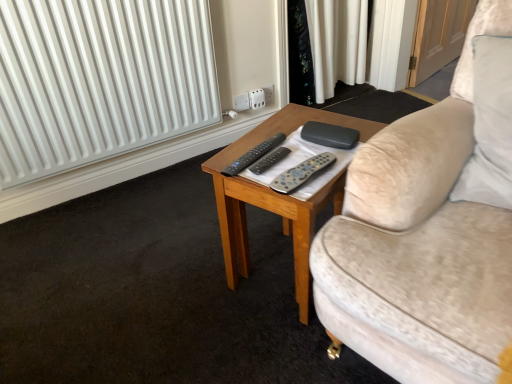
What are the coordinates of `black plastic remote control at center, arranged as the 2th remote control when viewed from the left` in the screenshot? It's located at coord(269,160).

Consider the image. How much space does black plastic remote control at center, which is counted as the 2th remote control, starting from the right, occupy vertically?

It is 1.18 inches.

Measure the distance between wooden coffee table at center and camera.

The distance of wooden coffee table at center from camera is 97.28 centimeters.

Find the location of a particular element. The width and height of the screenshot is (512, 384). white plastic socket at upper center is located at coordinates (257, 99).

The width and height of the screenshot is (512, 384). What do you see at coordinates (302, 173) in the screenshot?
I see `gray matte remote control at center, placed as the 3th remote control when sorted from left to right` at bounding box center [302, 173].

Identify the location of black plastic remote control at center, arranged as the 2th remote control when viewed from the left. (269, 160).

From a real-world perspective, is gray matte remote control at center, the 1th remote control viewed from the right, located higher than black matte case at center?

Incorrect, from a real-world perspective, gray matte remote control at center, the 1th remote control viewed from the right, is lower than black matte case at center.

The image size is (512, 384). Find the location of `pad above the gray matte remote control at center, placed as the 3th remote control when sorted from left to right (from a real-world perspective)`. pad above the gray matte remote control at center, placed as the 3th remote control when sorted from left to right (from a real-world perspective) is located at coordinates (330, 135).

Who is taller, gray matte remote control at center, placed as the 3th remote control when sorted from left to right, or black matte case at center?

With more height is black matte case at center.

Does black plastic remote control at center, which is counted as the 2th remote control, starting from the right, turn towards wooden coffee table at center?

No, black plastic remote control at center, which is counted as the 2th remote control, starting from the right, is not oriented towards wooden coffee table at center.

Are black plastic remote control at center, arranged as the 2th remote control when viewed from the left, and wooden coffee table at center far apart?

No, black plastic remote control at center, arranged as the 2th remote control when viewed from the left, is not far from wooden coffee table at center.

Considering the relative sizes of black plastic remote control at center, which is counted as the 2th remote control, starting from the right, and wooden coffee table at center in the image provided, is black plastic remote control at center, which is counted as the 2th remote control, starting from the right, wider than wooden coffee table at center?

No.

How much distance is there between black plastic remote control at center, which is counted as the 2th remote control, starting from the right, and wooden coffee table at center?

black plastic remote control at center, which is counted as the 2th remote control, starting from the right, and wooden coffee table at center are 8.84 inches apart from each other.

Is gray matte remote control at center, the 1th remote control viewed from the right, shorter than black plastic remote control at center, which is counted as the 2th remote control, starting from the right?

No.

From the image's perspective, which is below, gray matte remote control at center, the 1th remote control viewed from the right, or black plastic remote control at center, arranged as the 2th remote control when viewed from the left?

gray matte remote control at center, the 1th remote control viewed from the right, appears lower in the image.

Locate an element on the screen. The height and width of the screenshot is (384, 512). the 1st remote control above the gray matte remote control at center, placed as the 3th remote control when sorted from left to right (from the image's perspective) is located at coordinates (269, 160).

From a real-world perspective, is gray matte remote control at center, placed as the 3th remote control when sorted from left to right, positioned under black plastic remote control at center, arranged as the 2th remote control when viewed from the left, based on gravity?

No, from a real-world perspective, gray matte remote control at center, placed as the 3th remote control when sorted from left to right, is not under black plastic remote control at center, arranged as the 2th remote control when viewed from the left.

Which object is thinner, white plastic socket at upper center or black matte remote control at center, which appears as the first remote control when viewed from the left?

Thinner between the two is white plastic socket at upper center.

Considering the positions of objects white plastic socket at upper center and black matte remote control at center, which appears as the first remote control when viewed from the left, in the image provided, who is more to the left, white plastic socket at upper center or black matte remote control at center, which appears as the first remote control when viewed from the left,?

black matte remote control at center, which appears as the first remote control when viewed from the left.

From the picture: From the image's perspective, which is below, white plastic socket at upper center or black matte remote control at center, which appears as the first remote control when viewed from the left?

black matte remote control at center, which appears as the first remote control when viewed from the left, from the image's perspective.

Is white plastic socket at upper center placed right next to black matte remote control at center, which appears as the first remote control when viewed from the left?

No, white plastic socket at upper center is not beside black matte remote control at center, which appears as the first remote control when viewed from the left.

Is black matte case at center positioned far away from black plastic remote control at center, arranged as the 2th remote control when viewed from the left?

No.

Is black plastic remote control at center, which is counted as the 2th remote control, starting from the right, surrounded by black matte case at center?

That's incorrect, black plastic remote control at center, which is counted as the 2th remote control, starting from the right, is not inside black matte case at center.

Is black matte case at center facing towards black plastic remote control at center, arranged as the 2th remote control when viewed from the left?

Yes, black matte case at center is turned towards black plastic remote control at center, arranged as the 2th remote control when viewed from the left.

Is white plastic socket at upper center turned away from wooden coffee table at center?

No, white plastic socket at upper center is not facing away from wooden coffee table at center.

Is white plastic socket at upper center located outside wooden coffee table at center?

Yes.

Consider the image. From the image's perspective, is white plastic socket at upper center over wooden coffee table at center?

Yes, from the image's perspective, white plastic socket at upper center is above wooden coffee table at center.

This screenshot has height=384, width=512. I want to click on coffee table below the black matte case at center (from a real-world perspective), so click(276, 197).

Between wooden coffee table at center and black matte case at center, which one has less height?

Standing shorter between the two is black matte case at center.

Considering the sizes of objects wooden coffee table at center and black matte case at center in the image provided, who is thinner, wooden coffee table at center or black matte case at center?

Thinner between the two is black matte case at center.

I want to click on pad located behind the gray matte remote control at center, the 1th remote control viewed from the right, so click(330, 135).

The height and width of the screenshot is (384, 512). I want to click on the 2nd remote control positioned above the wooden coffee table at center (from the image's perspective), so click(x=269, y=160).

Looking at the image, which one is located closer to black plastic remote control at center, arranged as the 2th remote control when viewed from the left, black matte remote control at center, which appears as the first remote control when viewed from the left, or black matte case at center?

black matte remote control at center, which appears as the first remote control when viewed from the left, is closer to black plastic remote control at center, arranged as the 2th remote control when viewed from the left.

From the image, which object appears to be nearer to black matte remote control at center, which appears as the first remote control when viewed from the left, black matte case at center or black plastic remote control at center, which is counted as the 2th remote control, starting from the right?

The object closer to black matte remote control at center, which appears as the first remote control when viewed from the left, is black plastic remote control at center, which is counted as the 2th remote control, starting from the right.

Estimate the real-world distances between objects in this image. Which object is closer to black plastic remote control at center, which is counted as the 2th remote control, starting from the right, gray matte remote control at center, placed as the 3th remote control when sorted from left to right, or black matte remote control at center, the third remote control positioned from the right?

Among the two, black matte remote control at center, the third remote control positioned from the right, is located nearer to black plastic remote control at center, which is counted as the 2th remote control, starting from the right.

Considering their positions, is black matte remote control at center, the third remote control positioned from the right, positioned further to wooden coffee table at center than gray matte remote control at center, placed as the 3th remote control when sorted from left to right?

gray matte remote control at center, placed as the 3th remote control when sorted from left to right, lies further to wooden coffee table at center than the other object.

Considering their positions, is gray matte remote control at center, placed as the 3th remote control when sorted from left to right, positioned closer to black matte remote control at center, the third remote control positioned from the right, than white plastic socket at upper center?

gray matte remote control at center, placed as the 3th remote control when sorted from left to right, is closer to black matte remote control at center, the third remote control positioned from the right.

Which object lies nearer to the anchor point gray matte remote control at center, the 1th remote control viewed from the right, wooden coffee table at center or black matte case at center?

Among the two, black matte case at center is located nearer to gray matte remote control at center, the 1th remote control viewed from the right.

From the image, which object appears to be nearer to wooden coffee table at center, black matte remote control at center, which appears as the first remote control when viewed from the left, or white plastic socket at upper center?

black matte remote control at center, which appears as the first remote control when viewed from the left, is positioned closer to the anchor wooden coffee table at center.

From the image, which object appears to be farther from white plastic socket at upper center, black matte remote control at center, which appears as the first remote control when viewed from the left, or gray matte remote control at center, placed as the 3th remote control when sorted from left to right?

Among the two, gray matte remote control at center, placed as the 3th remote control when sorted from left to right, is located further to white plastic socket at upper center.

At what (x,y) coordinates should I click in order to perform the action: click on pad between gray matte remote control at center, the 1th remote control viewed from the right, and white plastic socket at upper center, along the z-axis. Please return your answer as a coordinate pair (x, y). Image resolution: width=512 pixels, height=384 pixels. Looking at the image, I should click on pos(330,135).

Locate an element on the screen. The image size is (512, 384). remote control between black plastic remote control at center, which is counted as the 2th remote control, starting from the right, and black matte case at center is located at coordinates (302, 173).

Find the location of `pad located between black matte remote control at center, which appears as the first remote control when viewed from the left, and white plastic socket at upper center in the depth direction`. pad located between black matte remote control at center, which appears as the first remote control when viewed from the left, and white plastic socket at upper center in the depth direction is located at coordinates (330, 135).

The image size is (512, 384). In order to click on remote control between black matte remote control at center, the third remote control positioned from the right, and gray matte remote control at center, placed as the 3th remote control when sorted from left to right, from left to right in this screenshot , I will do `click(269, 160)`.